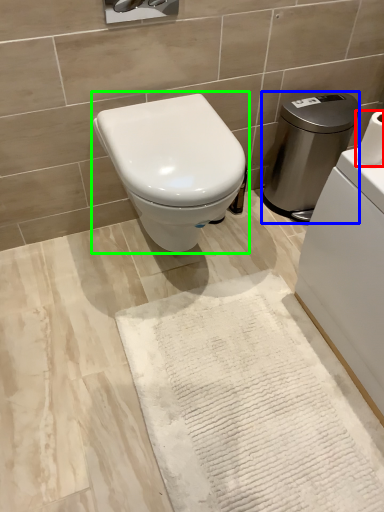
Question: Estimate the real-world distances between objects in this image. Which object is farther from toilet paper (highlighted by a red box), water heater (highlighted by a blue box) or toilet (highlighted by a green box)?

Choices:
 (A) water heater
 (B) toilet

Answer: (A)